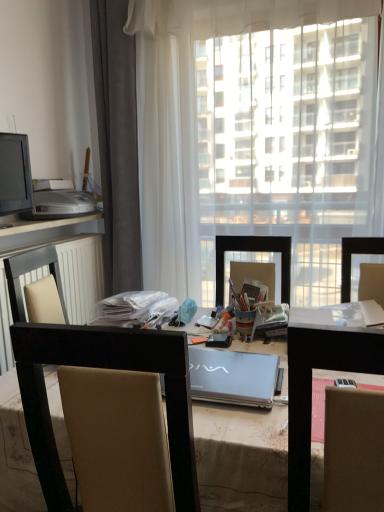
Find the location of `black plastic computer desk at lower left`. black plastic computer desk at lower left is located at coordinates (59, 268).

Find the location of a particular element. metallic silver laptop at center is located at coordinates (322, 368).

What do you see at coordinates (15, 174) in the screenshot? I see `matte black monitor at left` at bounding box center [15, 174].

The image size is (384, 512). In order to click on matte black monitor at left in this screenshot , I will do `click(15, 174)`.

I want to click on gray fabric curtain at left, so click(117, 143).

You are a GUI agent. You are given a task and a screenshot of the screen. Output one action in this format:
    pyautogui.click(x=<x>, y=<y>)
    Task: Click on the black plastic computer desk at lower left
    Image resolution: width=384 pixels, height=512 pixels.
    Given the screenshot: What is the action you would take?
    pyautogui.click(x=59, y=268)

Does transparent fabric at center have a larger size compared to black plastic computer desk at lower left?

Correct, transparent fabric at center is larger in size than black plastic computer desk at lower left.

Find the location of a particular element. The width and height of the screenshot is (384, 512). computer desk in front of the transparent fabric at center is located at coordinates (59, 268).

Visually, is transparent fabric at center positioned to the left or to the right of black plastic computer desk at lower left?

From the image, it's evident that transparent fabric at center is to the right of black plastic computer desk at lower left.

From a real-world perspective, is transparent fabric at center on black plastic computer desk at lower left?

Yes, from a real-world perspective, transparent fabric at center is above black plastic computer desk at lower left.

Can you confirm if transparent fabric at center is positioned to the right of matte black monitor at left?

Indeed, transparent fabric at center is positioned on the right side of matte black monitor at left.

Is transparent fabric at center taller or shorter than matte black monitor at left?

In the image, transparent fabric at center appears to be taller than matte black monitor at left.

From a real-world perspective, between transparent fabric at center and matte black monitor at left, who is vertically lower?

matte black monitor at left, from a real-world perspective.

From the picture: What's the angular difference between transparent fabric at center and beige fabric chair at center's facing directions?

transparent fabric at center and beige fabric chair at center are facing 5.1 degrees away from each other.

Is transparent fabric at center smaller than beige fabric chair at center?

Actually, transparent fabric at center might be larger than beige fabric chair at center.

From a real-world perspective, who is located lower, transparent fabric at center or beige fabric chair at center?

In real-world perspective, beige fabric chair at center is lower.

Is gray fabric curtain at left situated inside beige fabric chair at center or outside?

gray fabric curtain at left exists outside the volume of beige fabric chair at center.

Locate an element on the screen. curtain on the left of beige fabric chair at center is located at coordinates (117, 143).

Which is in front, point (112, 130) or point (18, 322)?

Point (18, 322)

Considering the sizes of objects gray fabric curtain at left and beige fabric chair at center in the image provided, who is shorter, gray fabric curtain at left or beige fabric chair at center?

beige fabric chair at center is shorter.

Based on the photo, can you tell me how much matte black monitor at left and gray fabric curtain at left differ in facing direction?

77.5 degrees separate the facing orientations of matte black monitor at left and gray fabric curtain at left.

Image resolution: width=384 pixels, height=512 pixels. I want to click on computer monitor below the gray fabric curtain at left (from a real-world perspective), so click(x=15, y=174).

In the scene shown: Which is more to the right, matte black monitor at left or gray fabric curtain at left?

From the viewer's perspective, gray fabric curtain at left appears more on the right side.

Considering the relative sizes of matte black monitor at left and gray fabric curtain at left in the image provided, is matte black monitor at left wider than gray fabric curtain at left?

No.

How distant is transparent fabric at center from gray fabric curtain at left?

A distance of 30.50 inches exists between transparent fabric at center and gray fabric curtain at left.

From the image's perspective, is transparent fabric at center above or below gray fabric curtain at left?

Based on their image positions, transparent fabric at center is located beneath gray fabric curtain at left.

Can you confirm if transparent fabric at center is shorter than gray fabric curtain at left?

Yes, transparent fabric at center is shorter than gray fabric curtain at left.

Which of these two, transparent fabric at center or gray fabric curtain at left, is bigger?

transparent fabric at center.

Considering the relative positions of matte black monitor at left and black plastic computer desk at lower left in the image provided, is matte black monitor at left to the right of black plastic computer desk at lower left from the viewer's perspective?

Incorrect, matte black monitor at left is not on the right side of black plastic computer desk at lower left.

Where is `computer desk in front of the matte black monitor at left`? computer desk in front of the matte black monitor at left is located at coordinates (59, 268).

Is matte black monitor at left further to camera compared to black plastic computer desk at lower left?

Yes, matte black monitor at left is behind black plastic computer desk at lower left.

Is matte black monitor at left turned away from black plastic computer desk at lower left?

No, black plastic computer desk at lower left is not at the back of matte black monitor at left.

I want to click on window screen that is on the right side of black plastic computer desk at lower left, so click(291, 145).

You are a GUI agent. You are given a task and a screenshot of the screen. Output one action in this format:
    pyautogui.click(x=<x>, y=<y>)
    Task: Click on the window screen above the matte black monitor at left (from a real-world perspective)
    This screenshot has width=384, height=512.
    Given the screenshot: What is the action you would take?
    pyautogui.click(x=291, y=145)

Estimate the real-world distances between objects in this image. Which object is closer to beige fabric chair at center, metallic silver laptop at center or gray fabric curtain at left?

metallic silver laptop at center is positioned closer to the anchor beige fabric chair at center.

Considering their positions, is gray fabric curtain at left positioned closer to metallic silver laptop at center than beige fabric chair at center?

Based on the image, beige fabric chair at center appears to be nearer to metallic silver laptop at center.

From the image, which object appears to be nearer to gray fabric curtain at left, beige fabric chair at center or metallic silver laptop at center?

Among the two, metallic silver laptop at center is located nearer to gray fabric curtain at left.

Considering their positions, is beige fabric chair at center positioned further to metallic silver laptop at center than matte black monitor at left?

matte black monitor at left.

Looking at this image, when comparing their distances from transparent fabric at center, does gray fabric curtain at left or metallic silver laptop at center seem further?

The object further to transparent fabric at center is metallic silver laptop at center.

From the image, which object appears to be nearer to black plastic computer desk at lower left, beige fabric chair at center or matte black monitor at left?

matte black monitor at left lies closer to black plastic computer desk at lower left than the other object.

Estimate the real-world distances between objects in this image. Which object is closer to beige fabric chair at center, matte black monitor at left or gray fabric curtain at left?

matte black monitor at left lies closer to beige fabric chair at center than the other object.

Considering their positions, is matte black monitor at left positioned closer to black plastic computer desk at lower left than gray fabric curtain at left?

matte black monitor at left is positioned closer to the anchor black plastic computer desk at lower left.

This screenshot has height=512, width=384. I want to click on computer desk between beige fabric chair at center and matte black monitor at left in the front-back direction, so click(x=59, y=268).

Where is `window screen between gray fabric curtain at left and black plastic computer desk at lower left from top to bottom`? The image size is (384, 512). window screen between gray fabric curtain at left and black plastic computer desk at lower left from top to bottom is located at coordinates point(291,145).

The image size is (384, 512). I want to click on computer monitor between metallic silver laptop at center and gray fabric curtain at left along the z-axis, so click(x=15, y=174).

The image size is (384, 512). What are the coordinates of `computer monitor between metallic silver laptop at center and transparent fabric at center along the z-axis` in the screenshot? It's located at (15, 174).